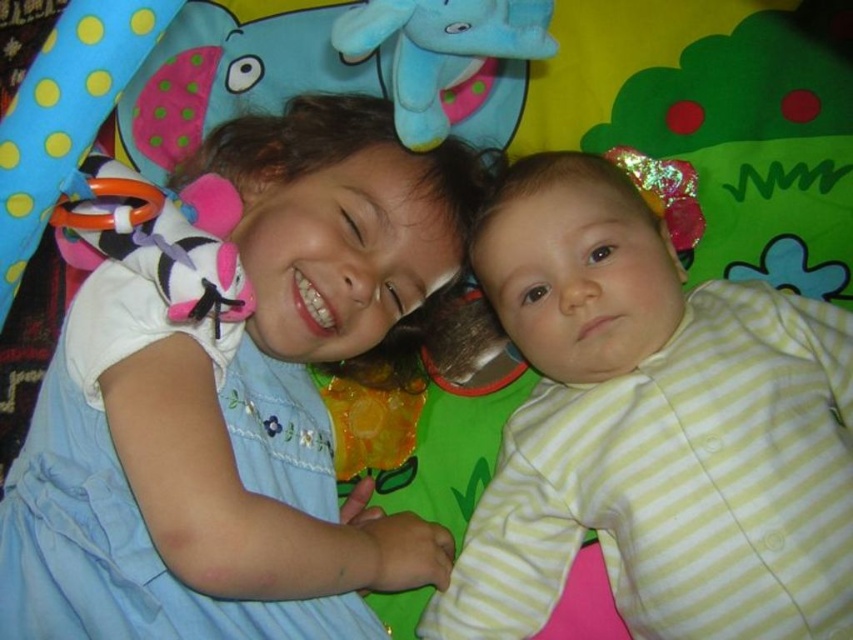
Which is in front, point (212, 545) or point (831, 506)?

Positioned in front is point (212, 545).

Where is `matte blue dress at upper left`? This screenshot has height=640, width=853. matte blue dress at upper left is located at coordinates (239, 404).

At what (x,y) coordinates should I click in order to perform the action: click on matte blue dress at upper left. Please return your answer as a coordinate pair (x, y). This screenshot has width=853, height=640. Looking at the image, I should click on (239, 404).

Does yellow striped fabric at upper right appear under blue plush elephant at upper center?

Yes.

Does yellow striped fabric at upper right have a lesser width compared to blue plush elephant at upper center?

In fact, yellow striped fabric at upper right might be wider than blue plush elephant at upper center.

Which is in front, point (640, 292) or point (462, 38)?

Point (462, 38)

The width and height of the screenshot is (853, 640). I want to click on yellow striped fabric at upper right, so click(x=654, y=429).

Can you confirm if matte blue dress at upper left is shorter than blue plush elephant at upper center?

Incorrect, matte blue dress at upper left's height does not fall short of blue plush elephant at upper center's.

Does matte blue dress at upper left appear on the right side of blue plush elephant at upper center?

In fact, matte blue dress at upper left is to the left of blue plush elephant at upper center.

Image resolution: width=853 pixels, height=640 pixels. What are the coordinates of `matte blue dress at upper left` in the screenshot? It's located at (239, 404).

This screenshot has width=853, height=640. I want to click on matte blue dress at upper left, so click(x=239, y=404).